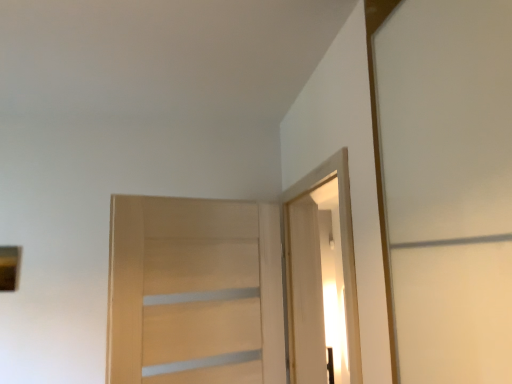
Question: From a real-world perspective, is white glossy elevator at upper right above or below white wood door at upper right, which appears as the first door when viewed from the right?

Choices:
 (A) below
 (B) above

Answer: (B)

Question: Relative to white wood door at upper right, which is the second door in left-to-right order, is white glossy elevator at upper right in front or behind?

Choices:
 (A) front
 (B) behind

Answer: (A)

Question: Which object is the farthest from the light wood door at center, which is the 2th door from right to left?

Choices:
 (A) white wood door at upper right, which is the second door in left-to-right order
 (B) white glossy elevator at upper right

Answer: (B)

Question: Considering the real-world distances, which object is closest to the white wood door at upper right, which appears as the first door when viewed from the right?

Choices:
 (A) light wood door at center, which is the 2th door from right to left
 (B) white glossy elevator at upper right

Answer: (B)